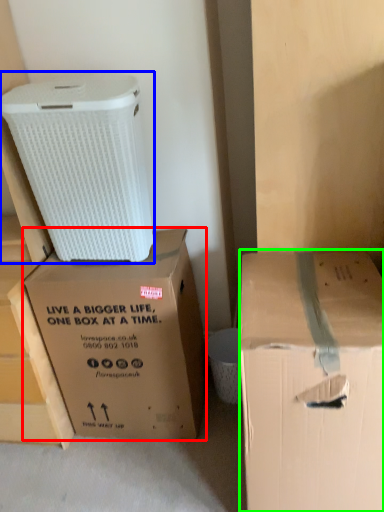
Question: Based on their relative distances, which object is nearer to box (highlighted by a red box)? Choose from cardboard box (highlighted by a blue box) and box (highlighted by a green box).

Choices:
 (A) cardboard box
 (B) box

Answer: (A)